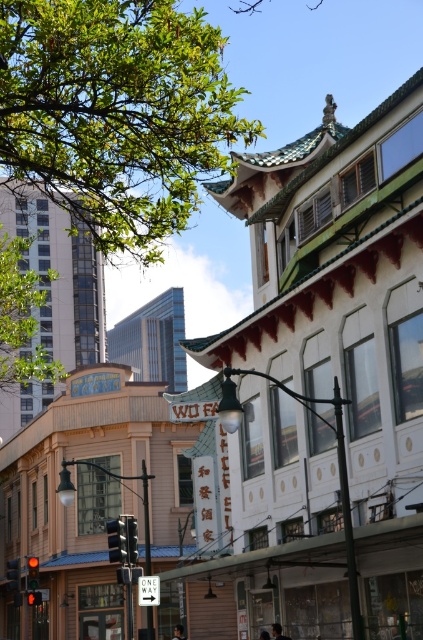
You are a photographer standing at the edge of the street. You want to take a photo of the dark hair person at center and the smooth skin face at center so that both are clearly visible in the frame. Given that your camera has a maximum focus range of 10 meters, will you be able to capture both subjects in focus?

The distance between the dark hair person at center and the smooth skin face at center is 11.31 meters, which exceeds the camera maximum focus range of 10 meters. Therefore, it will be difficult to capture both subjects in focus simultaneously.

You are a photographer trying to capture a portrait of a person in this scene. The person has dark brown hair at lower center and a smooth skin face at center. Which part of their appearance takes up more visual space in the photo?

The smooth skin face at center takes up more visual space than the dark brown hair at lower center because the dark brown hair at lower center occupies less space than smooth skin face at center.